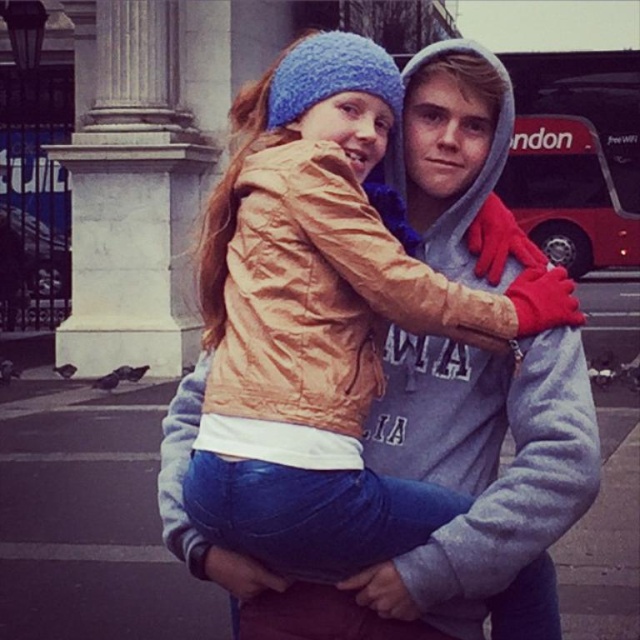
The width and height of the screenshot is (640, 640). What do you see at coordinates (132, 198) in the screenshot? I see `white marble pillar at upper left` at bounding box center [132, 198].

Between white marble pillar at upper left and matte orange jacket at center, which one appears on the right side from the viewer's perspective?

matte orange jacket at center

Where is `white marble pillar at upper left`? This screenshot has height=640, width=640. white marble pillar at upper left is located at coordinates (132, 198).